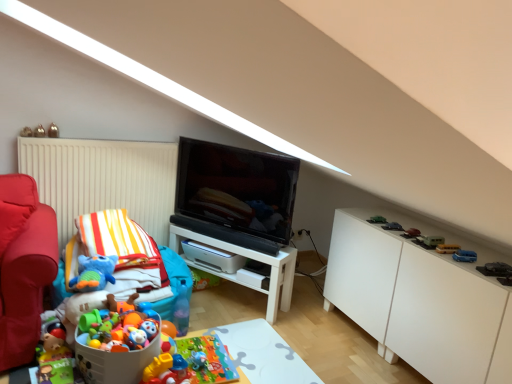
I want to click on vacant space in front of blue plastic toy car at lower right, the 5th toy ordered from the bottom, so click(473, 266).